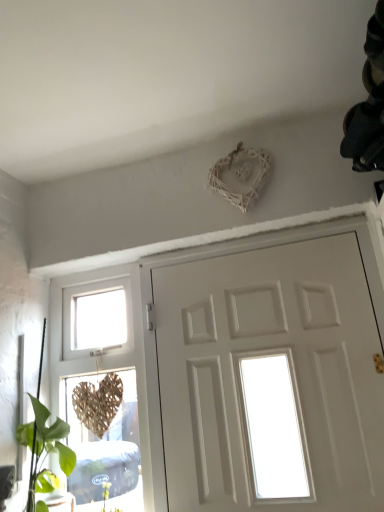
Question: Does woven wood heart at left appear on the right side of white matte door at center?

Choices:
 (A) yes
 (B) no

Answer: (B)

Question: Is woven wood heart at left shorter than white matte door at center?

Choices:
 (A) no
 (B) yes

Answer: (A)

Question: Is woven wood heart at left positioned behind white matte door at center?

Choices:
 (A) yes
 (B) no

Answer: (A)

Question: From the image's perspective, would you say woven wood heart at left is shown under white matte door at center?

Choices:
 (A) yes
 (B) no

Answer: (A)

Question: Considering the relative sizes of woven wood heart at left and white matte door at center in the image provided, is woven wood heart at left wider than white matte door at center?

Choices:
 (A) no
 (B) yes

Answer: (B)

Question: Is the position of woven wood heart at left less distant than that of white matte door at center?

Choices:
 (A) no
 (B) yes

Answer: (A)

Question: From the image's perspective, is white matte door at center below woven wood heart at left?

Choices:
 (A) yes
 (B) no

Answer: (B)

Question: Does white matte door at center have a lesser height compared to woven wood heart at left?

Choices:
 (A) no
 (B) yes

Answer: (B)

Question: Does white matte door at center have a smaller size compared to woven wood heart at left?

Choices:
 (A) no
 (B) yes

Answer: (A)

Question: Does white matte door at center have a greater height compared to woven wood heart at left?

Choices:
 (A) yes
 (B) no

Answer: (B)

Question: Does white matte door at center lie behind woven wood heart at left?

Choices:
 (A) no
 (B) yes

Answer: (A)

Question: Is white matte door at center not close to woven wood heart at left?

Choices:
 (A) yes
 (B) no

Answer: (B)

Question: Choose the correct answer: Is white matte door at center inside woven wood heart at left or outside it?

Choices:
 (A) outside
 (B) inside

Answer: (A)